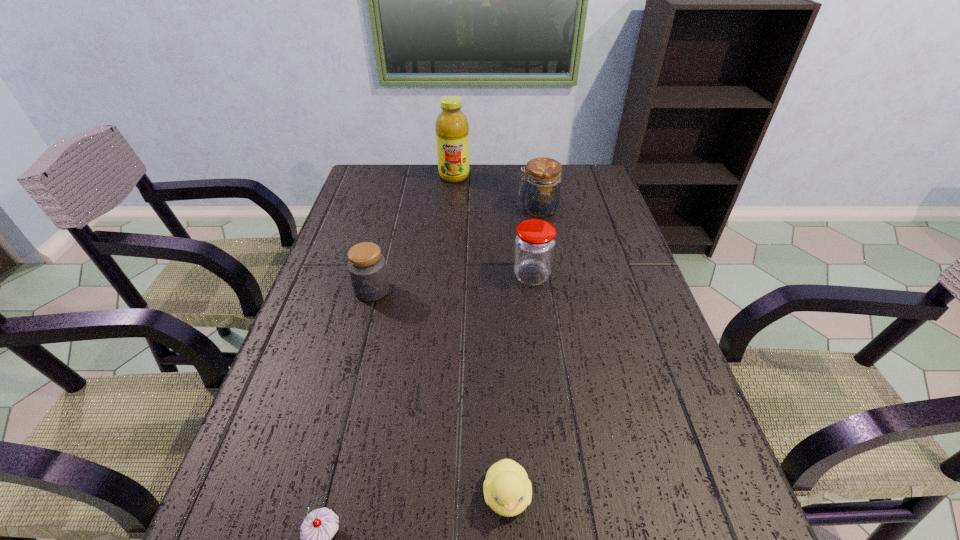
You are a GUI agent. You are given a task and a screenshot of the screen. Output one action in this format:
    pyautogui.click(x=<x>, y=<y>)
    Task: Click on the vacant area that lies between the leftmost jar and the third object from left to right
    The width and height of the screenshot is (960, 540).
    Given the screenshot: What is the action you would take?
    click(413, 233)

Identify the location of free spot between the fifth nearest object and the duckling. pos(522,352).

Find the location of a particular element. blank region between the third shortest object and the fruit juice is located at coordinates (413, 233).

Identify which object is located as the fifth nearest to the fifth nearest object. Please provide its 2D coordinates. Your answer should be formatted as a tuple, i.e. [(x, y)], where the tuple contains the x and y coordinates of a point satisfying the conditions above.

[(318, 528)]

Locate which object ranks fourth in proximity to the farthest jar. Please provide its 2D coordinates. Your answer should be formatted as a tuple, i.e. [(x, y)], where the tuple contains the x and y coordinates of a point satisfying the conditions above.

[(507, 490)]

Choose which jar is the second nearest neighbor to the farthest object. Please provide its 2D coordinates. Your answer should be formatted as a tuple, i.e. [(x, y)], where the tuple contains the x and y coordinates of a point satisfying the conditions above.

[(534, 244)]

Image resolution: width=960 pixels, height=540 pixels. In order to click on the second closest jar to the cupcake in this screenshot , I will do (534, 244).